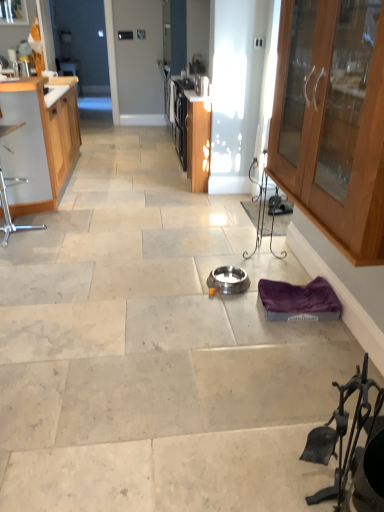
Image resolution: width=384 pixels, height=512 pixels. Find the location of `free space to the left of black wrought iron fireplace tools at lower right, which is the first chair from front to back`. free space to the left of black wrought iron fireplace tools at lower right, which is the first chair from front to back is located at coordinates (273, 480).